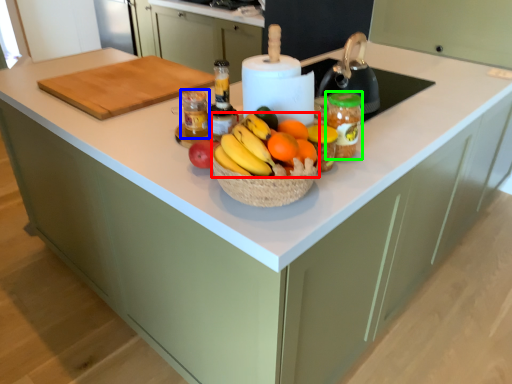
Question: Which object is positioned closest to grapefruit (highlighted by a red box)? Select from bottle (highlighted by a blue box) and glass jar (highlighted by a green box).

Choices:
 (A) bottle
 (B) glass jar

Answer: (B)